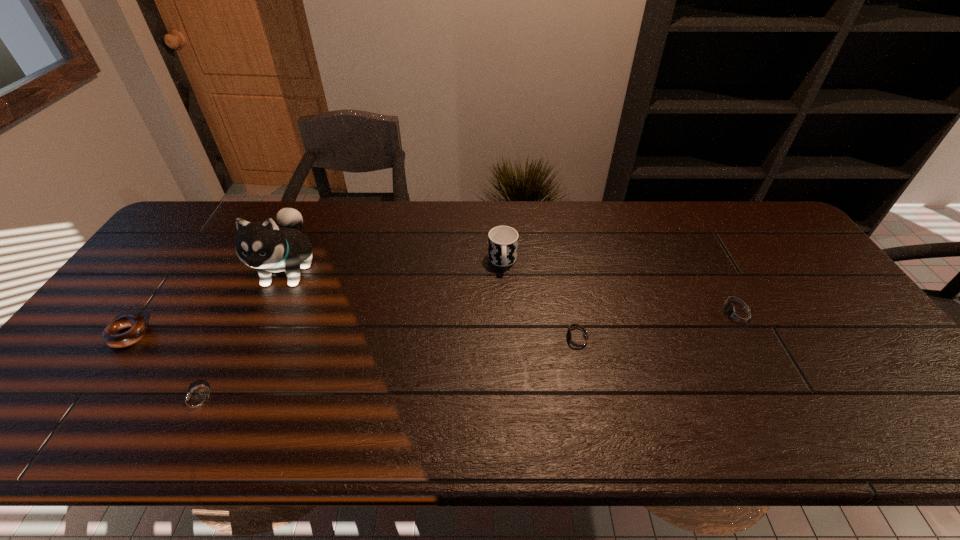
Find the location of a particular element. vacant space situated at the face of the puppy is located at coordinates (244, 363).

This screenshot has width=960, height=540. Identify the location of vacant space located 0.200m on the side of the second tallest object with the handle. (506, 327).

In order to click on object that is at the far edge in this screenshot , I will do `click(262, 245)`.

At what (x,y) coordinates should I click in order to perform the action: click on object present at the near edge. Please return your answer as a coordinate pair (x, y). Looking at the image, I should click on (196, 401).

At what (x,y) coordinates should I click in order to perform the action: click on object that is at the left edge. Please return your answer as a coordinate pair (x, y). Looking at the image, I should click on click(x=111, y=335).

Locate an element on the screen. The image size is (960, 540). vacant space at the far edge of the desktop is located at coordinates (308, 208).

The width and height of the screenshot is (960, 540). Find the location of `free region at the near edge of the desktop`. free region at the near edge of the desktop is located at coordinates (548, 389).

The width and height of the screenshot is (960, 540). Find the location of `vacant space at the left edge of the desktop`. vacant space at the left edge of the desktop is located at coordinates (143, 300).

Locate an element on the screen. The image size is (960, 540). free space at the near right corner of the desktop is located at coordinates (861, 376).

Find the location of a particular element. Image resolution: width=960 pixels, height=540 pixels. unoccupied area between the leftmost object and the leftmost watch is located at coordinates (163, 368).